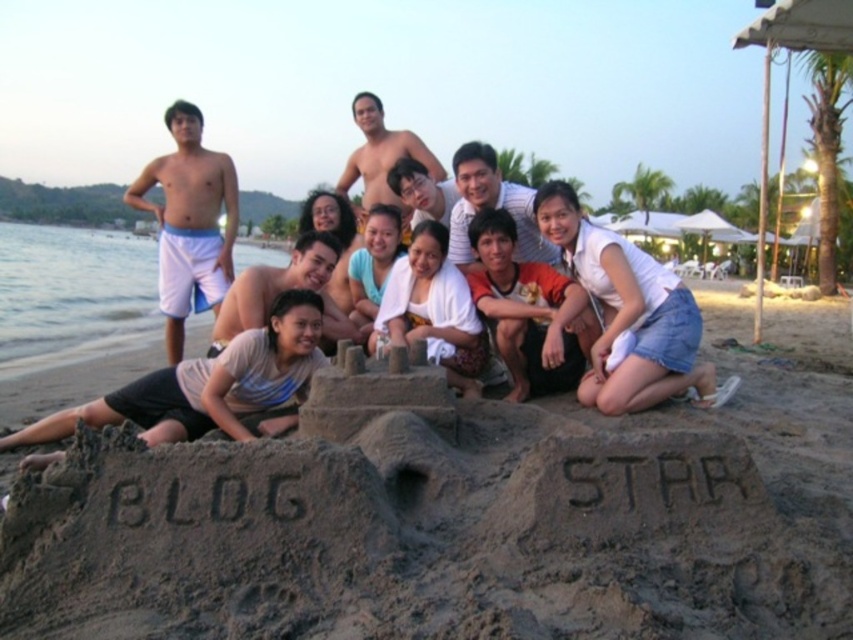
Question: Does white cotton shirt at lower center have a smaller size compared to white towel at center?

Choices:
 (A) yes
 (B) no

Answer: (A)

Question: Which object appears closest to the camera in this image?

Choices:
 (A) white towel at center
 (B) white cotton shirt at lower center

Answer: (A)

Question: Which point is farther from the camera taking this photo?

Choices:
 (A) (440, 360)
 (B) (556, 372)

Answer: (B)

Question: Is white cotton shirt at lower center to the right of white towel at center from the viewer's perspective?

Choices:
 (A) no
 (B) yes

Answer: (B)

Question: Is white cotton shirt at lower center to the right of white towel at center from the viewer's perspective?

Choices:
 (A) no
 (B) yes

Answer: (B)